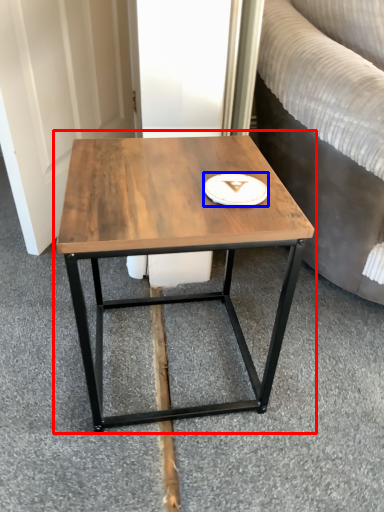
Question: Which object appears closest to the camera in this image, coffee table (highlighted by a red box) or platter (highlighted by a blue box)?

Choices:
 (A) coffee table
 (B) platter

Answer: (A)